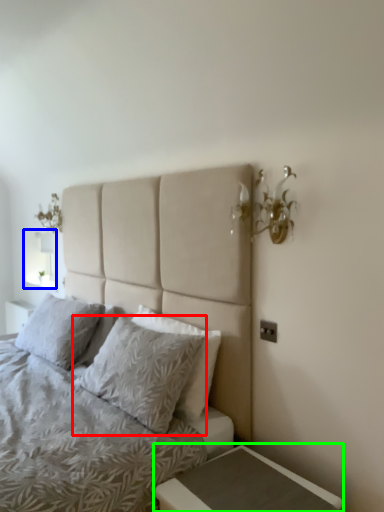
Question: Based on their relative distances, which object is farther from pillow (highlighted by a red box)? Choose from window screen (highlighted by a blue box) and nightstand (highlighted by a green box).

Choices:
 (A) window screen
 (B) nightstand

Answer: (A)